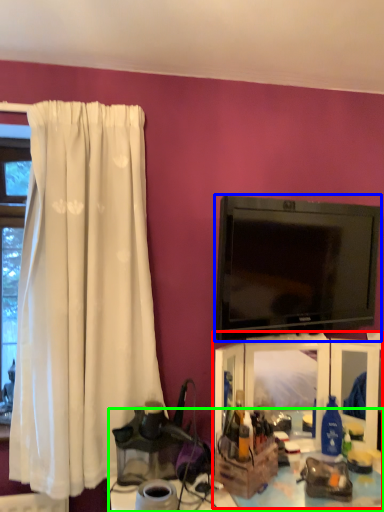
Question: Estimate the real-world distances between objects in this image. Which object is farther from entertainment center (highlighted by a red box), television (highlighted by a blue box) or table (highlighted by a green box)?

Choices:
 (A) television
 (B) table

Answer: (A)